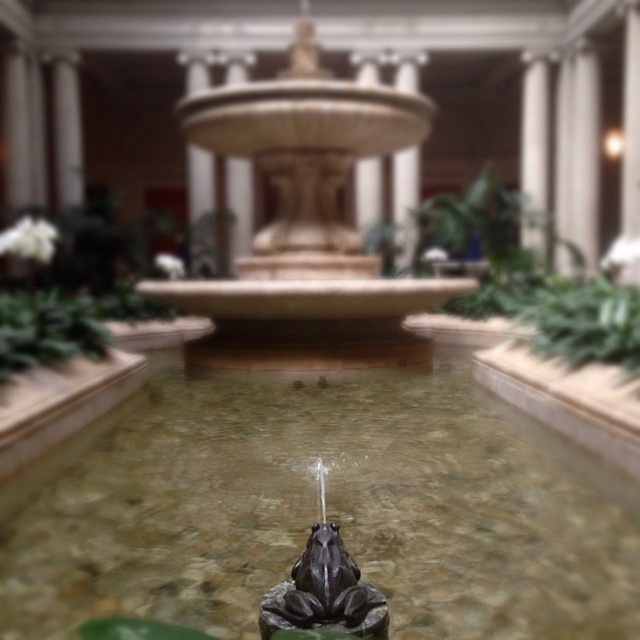
Question: Does beige stone fountain at center appear over green leafy plant at center?

Choices:
 (A) yes
 (B) no

Answer: (A)

Question: Which object is positioned farthest from the green leafy plant at center?

Choices:
 (A) beige stone fountain at center
 (B) clear water at center

Answer: (A)

Question: Where is clear water at center located in relation to green leafy plant at center in the image?

Choices:
 (A) left
 (B) right

Answer: (A)

Question: Which point is farther to the camera?

Choices:
 (A) green leafy plant at center
 (B) beige stone fountain at center

Answer: (B)

Question: Is clear water at center below beige stone fountain at center?

Choices:
 (A) yes
 (B) no

Answer: (A)

Question: Estimate the real-world distances between objects in this image. Which object is closer to the beige stone fountain at center?

Choices:
 (A) clear water at center
 (B) green leafy plant at center

Answer: (A)